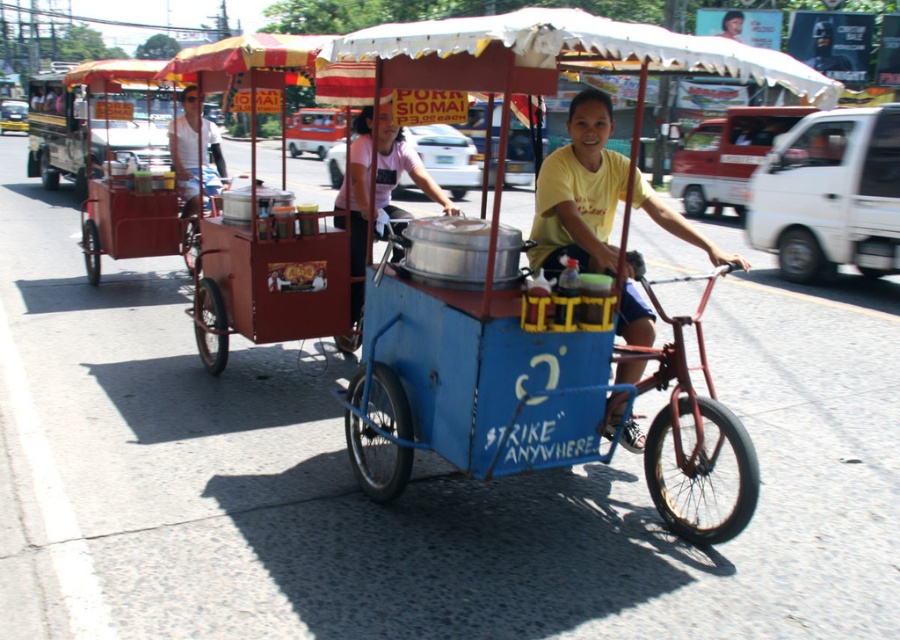
Looking at this image, who is more forward, (277, 84) or (176, 170)?

Positioned in front is point (277, 84).

This screenshot has height=640, width=900. I want to click on matte red cart at left, so click(270, 278).

Which is more to the right, yellow matte shirt at center or metallic silver pot at center?

Positioned to the right is yellow matte shirt at center.

At what (x,y) coordinates should I click in order to perform the action: click on yellow matte shirt at center. Please return your answer as a coordinate pair (x, y). The image size is (900, 640). Looking at the image, I should click on (579, 193).

Between point (345, 282) and point (342, 339), which one is positioned in front?

Point (345, 282) is in front.

Does point (259, 248) come farther from viewer compared to point (360, 170)?

No, it is in front of (360, 170).

Describe the element at coordinates (270, 278) in the screenshot. I see `matte red cart at left` at that location.

Identify the location of matte red cart at left. The height and width of the screenshot is (640, 900). (270, 278).